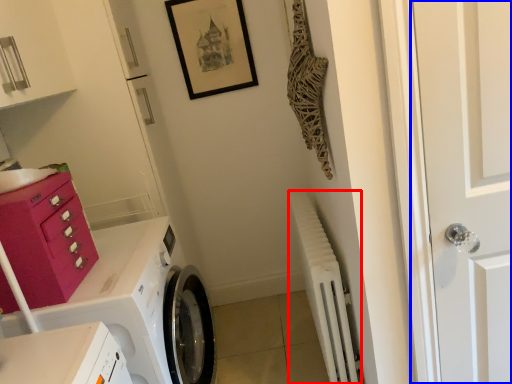
Question: Which object appears farthest to the camera in this image, radiator (highlighted by a red box) or door (highlighted by a blue box)?

Choices:
 (A) radiator
 (B) door

Answer: (A)